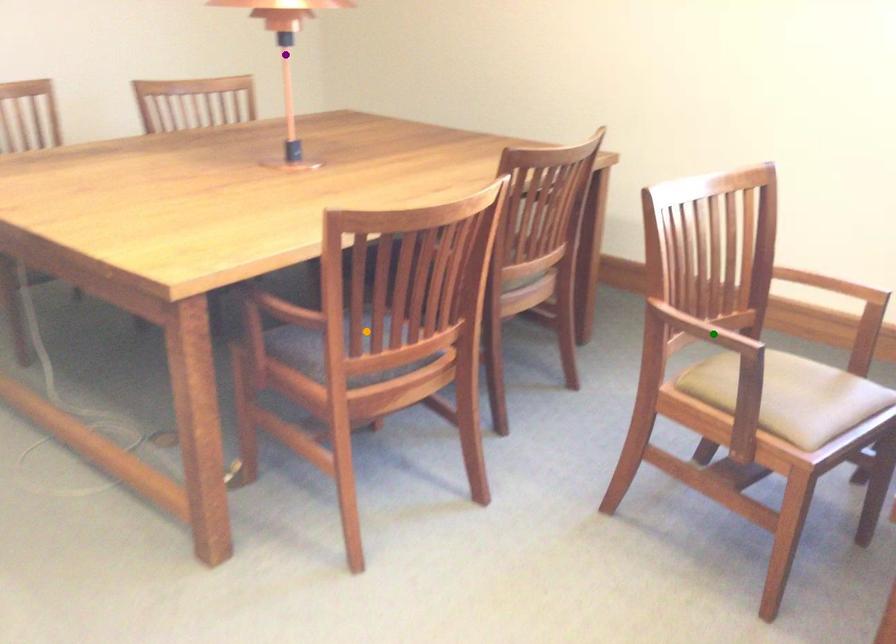
Order these from nearest to farthest:
orange point, purple point, green point

purple point, orange point, green point